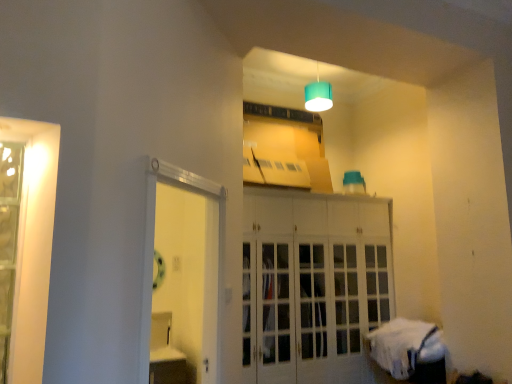
Question: From their relative heights in the image, would you say clear glass door at left is taller or shorter than white glossy door at center?

Choices:
 (A) tall
 (B) short

Answer: (B)

Question: From the image's perspective, is clear glass door at left above or below white glossy door at center?

Choices:
 (A) below
 (B) above

Answer: (B)

Question: Which object is the farthest from the clear glass door at left?

Choices:
 (A) white glossy door at center
 (B) teal fabric lampshade at upper center
 (C) white glass cabinet at center
 (D) white fabric bed at lower right

Answer: (B)

Question: Which of these objects is positioned farthest from the white glossy door at center?

Choices:
 (A) white fabric bed at lower right
 (B) teal fabric lampshade at upper center
 (C) white glass cabinet at center
 (D) clear glass door at left

Answer: (D)